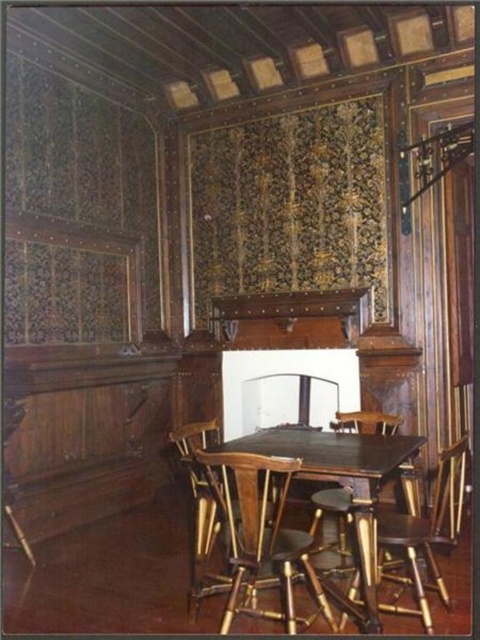
You are a guest entering the room and see the wooden table at center and the wooden chair at center. Which object is taller?

The wooden table at center is much taller than the wooden chair at center.

You are planning to place a decorative centerpiece on the wooden table at center. Considering the size of the wooden chair at center, will the table have enough space to accommodate the centerpiece without it being too close to the chair?

The wooden table at center is wider than the wooden chair at center, so there should be sufficient space to place the decorative centerpiece without it being too close to the chair.

You are standing in the center of the room and want to move towards the wooden bar stool at center. Which direction should you move?

Since the wooden bar stool at center is already at the center of the room, you are already at the correct position to reach it.